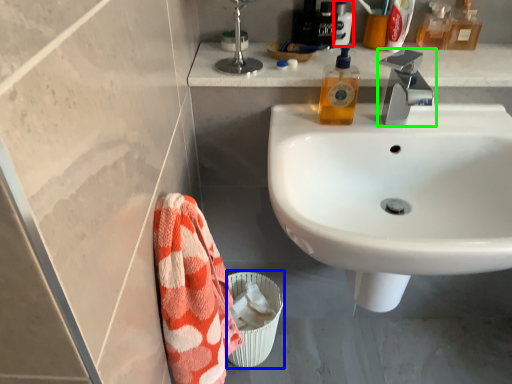
Question: Based on their relative distances, which object is nearer to toiletry (highlighted by a red box)? Choose from toilet bowl (highlighted by a blue box) and tap (highlighted by a green box).

Choices:
 (A) toilet bowl
 (B) tap

Answer: (B)